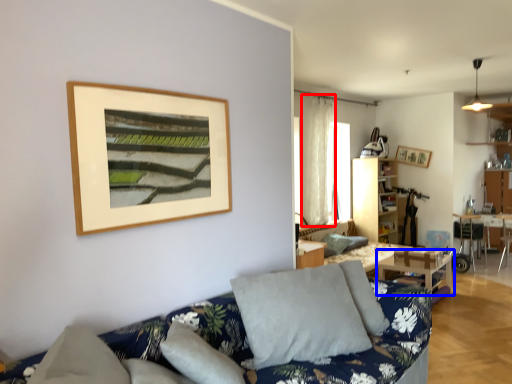
Question: Which of the following is the closest to the observer, curtain (highlighted by a red box) or table (highlighted by a blue box)?

Choices:
 (A) curtain
 (B) table

Answer: (B)